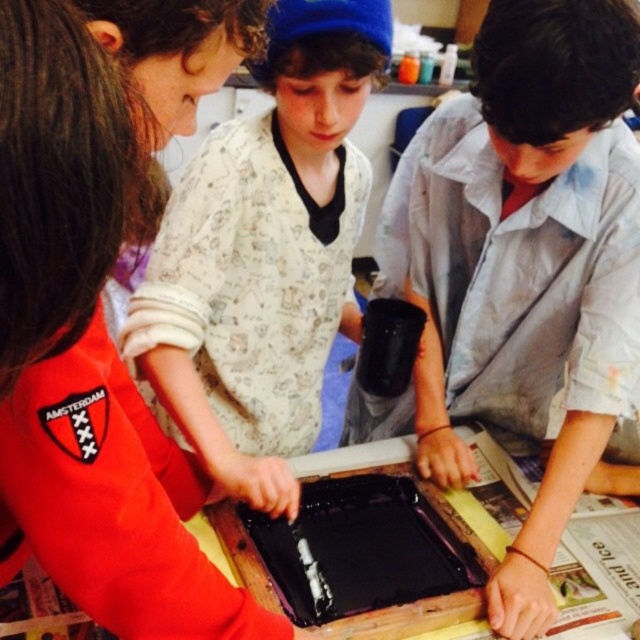
Question: Does matte black tray at center have a larger size compared to black plastic tray at center?

Choices:
 (A) no
 (B) yes

Answer: (B)

Question: Which object is positioned closest to the black plastic tray at center?

Choices:
 (A) matte black tray at center
 (B) matte white shirt at center

Answer: (B)

Question: Which of these objects is positioned farthest from the black plastic tray at center?

Choices:
 (A) matte white shirt at center
 (B) matte black tray at center

Answer: (B)

Question: Considering the relative positions of matte white shirt at center and black plastic tray at center in the image provided, where is matte white shirt at center located with respect to black plastic tray at center?

Choices:
 (A) left
 (B) right

Answer: (A)

Question: Which object is positioned closest to the light gray cotton shirt at center?

Choices:
 (A) matte black tray at center
 (B) black plastic tray at center
 (C) matte white shirt at center

Answer: (B)

Question: Can you confirm if matte black tray at center is positioned below light gray cotton shirt at center?

Choices:
 (A) no
 (B) yes

Answer: (B)